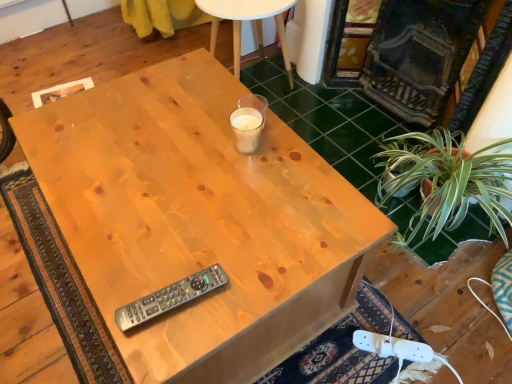
I want to click on vacant space to the left of translucent glass candle at center, the 2th coffee cup when ordered from top to bottom, so click(x=184, y=142).